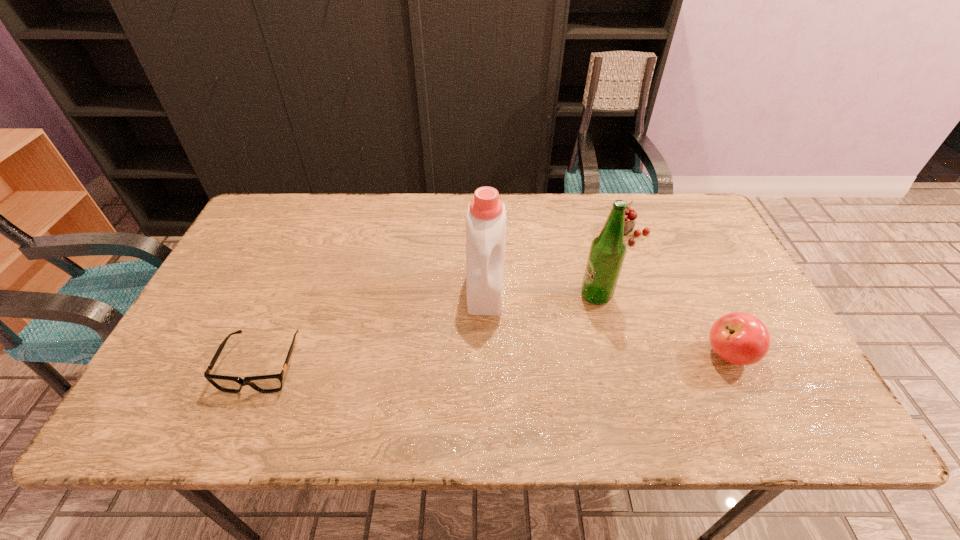
Find the location of a particular element. The height and width of the screenshot is (540, 960). free space on the desktop that is between the shortest object and the apple and is positioned on the handle side of the farthest object is located at coordinates (468, 360).

Where is `vacant space on the desktop that is between the leftmost object and the rightmost object and is positioned on the handle side of the fourth object from right to left`? The image size is (960, 540). vacant space on the desktop that is between the leftmost object and the rightmost object and is positioned on the handle side of the fourth object from right to left is located at coordinates (482, 360).

At what (x,y) coordinates should I click in order to perform the action: click on vacant space on the desktop that is between the sunglasses and the rightmost object and is positioned on the label of the beer bottle. Please return your answer as a coordinate pair (x, y). Looking at the image, I should click on (537, 359).